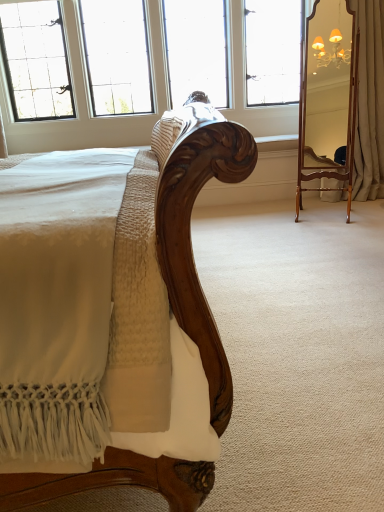
Question: Should I look upward or downward to see wooden mirror at right?

Choices:
 (A) up
 (B) down

Answer: (A)

Question: Should I look upward or downward to see clear glass window at upper center?

Choices:
 (A) up
 (B) down

Answer: (A)

Question: From a real-world perspective, does clear glass window at upper center sit lower than beige fabric curtain at right?

Choices:
 (A) yes
 (B) no

Answer: (B)

Question: Does clear glass window at upper center have a greater height compared to beige fabric curtain at right?

Choices:
 (A) no
 (B) yes

Answer: (A)

Question: Would you consider clear glass window at upper center to be distant from beige fabric curtain at right?

Choices:
 (A) yes
 (B) no

Answer: (A)

Question: Can beige fabric curtain at right be found inside clear glass window at upper center?

Choices:
 (A) yes
 (B) no

Answer: (B)

Question: Considering the relative sizes of clear glass window at upper center and beige fabric curtain at right in the image provided, is clear glass window at upper center bigger than beige fabric curtain at right?

Choices:
 (A) yes
 (B) no

Answer: (A)

Question: From the image's perspective, would you say clear glass window at upper center is shown under beige fabric curtain at right?

Choices:
 (A) yes
 (B) no

Answer: (B)

Question: Is clear glass window at upper center thinner than wooden mirror at right?

Choices:
 (A) yes
 (B) no

Answer: (B)

Question: From the image's perspective, is clear glass window at upper center beneath wooden mirror at right?

Choices:
 (A) yes
 (B) no

Answer: (B)

Question: Is clear glass window at upper center directly adjacent to wooden mirror at right?

Choices:
 (A) yes
 (B) no

Answer: (B)

Question: Is clear glass window at upper center to the right of wooden mirror at right from the viewer's perspective?

Choices:
 (A) no
 (B) yes

Answer: (A)

Question: From the image's perspective, is clear glass window at upper center on top of wooden mirror at right?

Choices:
 (A) no
 (B) yes

Answer: (B)

Question: From a real-world perspective, does clear glass window at upper center stand above wooden mirror at right?

Choices:
 (A) no
 (B) yes

Answer: (B)

Question: Does wooden mirror at right have a smaller size compared to clear glass window at upper center?

Choices:
 (A) no
 (B) yes

Answer: (B)